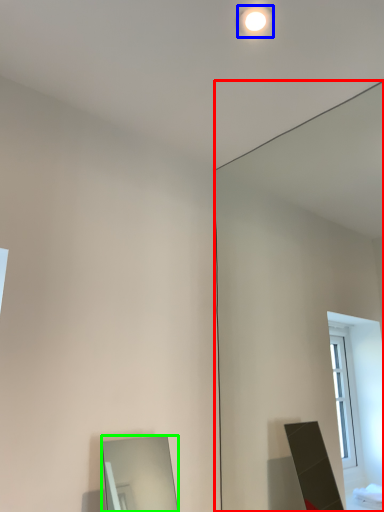
Question: Considering the real-world distances, which object is farthest from mirror (highlighted by a red box)? lighting (highlighted by a blue box) or mirror (highlighted by a green box)?

Choices:
 (A) lighting
 (B) mirror

Answer: (B)